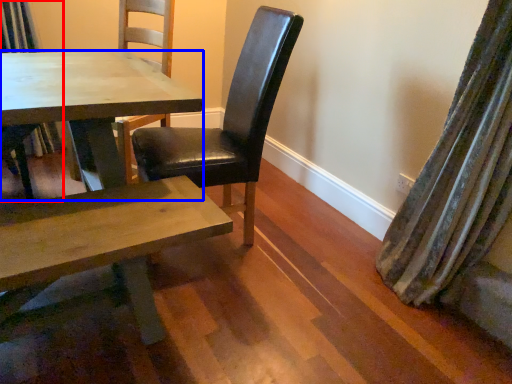
Question: Which object is further to the camera taking this photo, chair (highlighted by a red box) or kitchen & dining room table (highlighted by a blue box)?

Choices:
 (A) chair
 (B) kitchen & dining room table

Answer: (A)